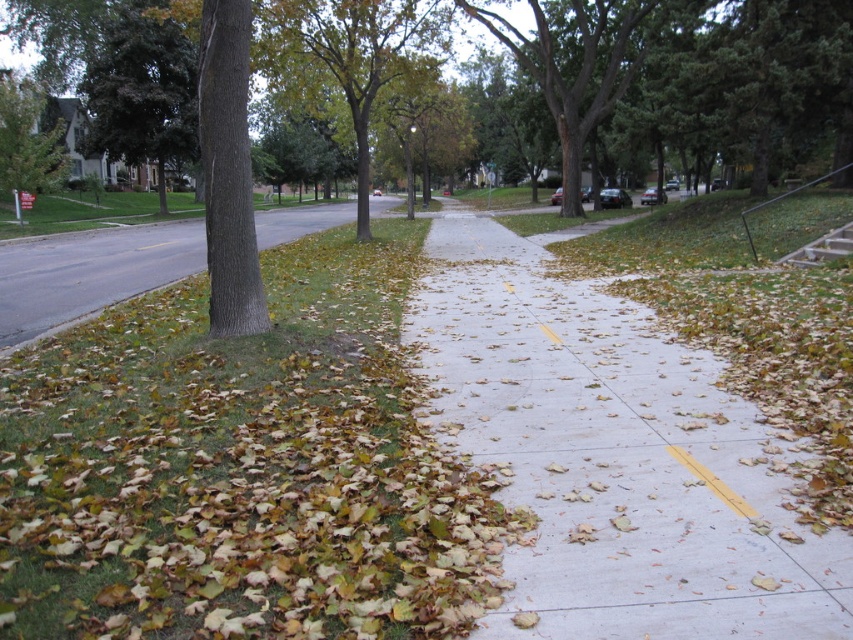
At what (x,y) coordinates should I click in order to perform the action: click on brown concrete sidewalk at left. Please return your answer as a coordinate pair (x, y). Image resolution: width=853 pixels, height=640 pixels. Looking at the image, I should click on (90, 275).

In the scene shown: Is brown concrete sidewalk at left taller than green leafy tree at center?

Incorrect, brown concrete sidewalk at left's height is not larger of green leafy tree at center's.

Identify the location of brown concrete sidewalk at left. Image resolution: width=853 pixels, height=640 pixels. (90, 275).

Is concrete sidewalk at center wider than green leafy tree at left?

No.

Does point (505, 314) lie in front of point (109, 147)?

That is True.

Which is behind, point (662, 513) or point (148, 76)?

Positioned behind is point (148, 76).

Find the location of a particular element. This screenshot has width=853, height=640. concrete sidewalk at center is located at coordinates (614, 456).

Which is in front, point (119, 152) or point (22, 163)?

Point (22, 163) is in front.

Can you confirm if green leafy tree at left is bigger than green leafy tree at upper left?

Yes.

The image size is (853, 640). Identify the location of green leafy tree at left. (142, 93).